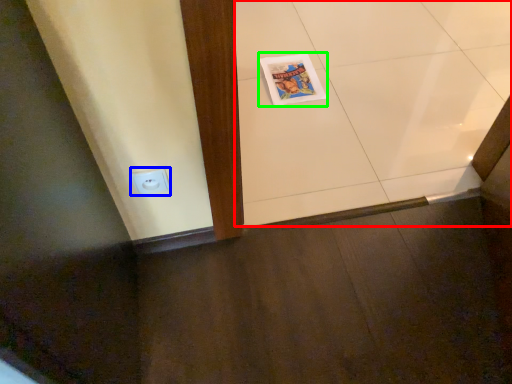
Question: Based on their relative distances, which object is nearer to ceramic tile (highlighted by a red box)? Choose from electric outlet (highlighted by a blue box) and comic book (highlighted by a green box).

Choices:
 (A) electric outlet
 (B) comic book

Answer: (B)